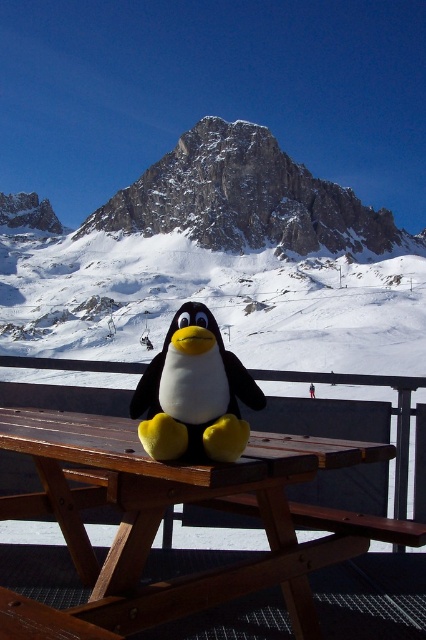
Question: Which object appears farthest from the camera in this image?

Choices:
 (A) wooden picnic table at center
 (B) yellow plush penguin at center
 (C) snowy granite mountain at center

Answer: (C)

Question: Can you confirm if wooden picnic table at center is positioned above snowy granite mountain at center?

Choices:
 (A) yes
 (B) no

Answer: (B)

Question: Which point is farther to the camera?

Choices:
 (A) (121, 600)
 (B) (186, 188)

Answer: (B)

Question: Where is snowy granite mountain at center located in relation to yellow plush penguin at center in the image?

Choices:
 (A) above
 (B) below

Answer: (A)

Question: Which object is the closest to the yellow plush penguin at center?

Choices:
 (A) snowy granite mountain at center
 (B) wooden picnic table at center

Answer: (B)

Question: Can you confirm if wooden picnic table at center is positioned to the left of yellow plush penguin at center?

Choices:
 (A) no
 (B) yes

Answer: (B)